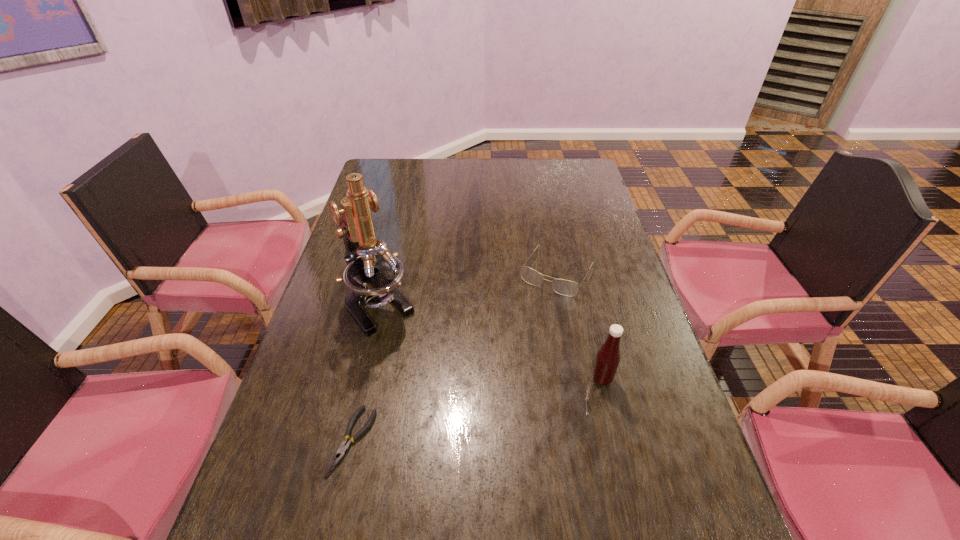
Where is `vacant space in between the third farthest object and the third tallest object`? This screenshot has width=960, height=540. vacant space in between the third farthest object and the third tallest object is located at coordinates point(580,326).

At what (x,y) coordinates should I click in order to perform the action: click on free spot between the pliers and the tallest object. Please return your answer as a coordinate pair (x, y). Looking at the image, I should click on (366, 373).

Locate an element on the screen. free space between the second shortest object and the Tabasco sauce is located at coordinates (580, 326).

Identify the location of vacant area that lies between the third shortest object and the second shortest object. (580, 326).

I want to click on vacant space that's between the Tabasco sauce and the nearest object, so click(477, 410).

Point out which object is positioned as the second nearest to the Tabasco sauce. Please provide its 2D coordinates. Your answer should be formatted as a tuple, i.e. [(x, y)], where the tuple contains the x and y coordinates of a point satisfying the conditions above.

[(373, 275)]

Select which object appears as the third closest to the nearest object. Please provide its 2D coordinates. Your answer should be formatted as a tuple, i.e. [(x, y)], where the tuple contains the x and y coordinates of a point satisfying the conditions above.

[(607, 360)]

I want to click on vacant point that satisfies the following two spatial constraints: 1. on the back side of the shortest object; 2. on the left side of the third tallest object, so click(392, 272).